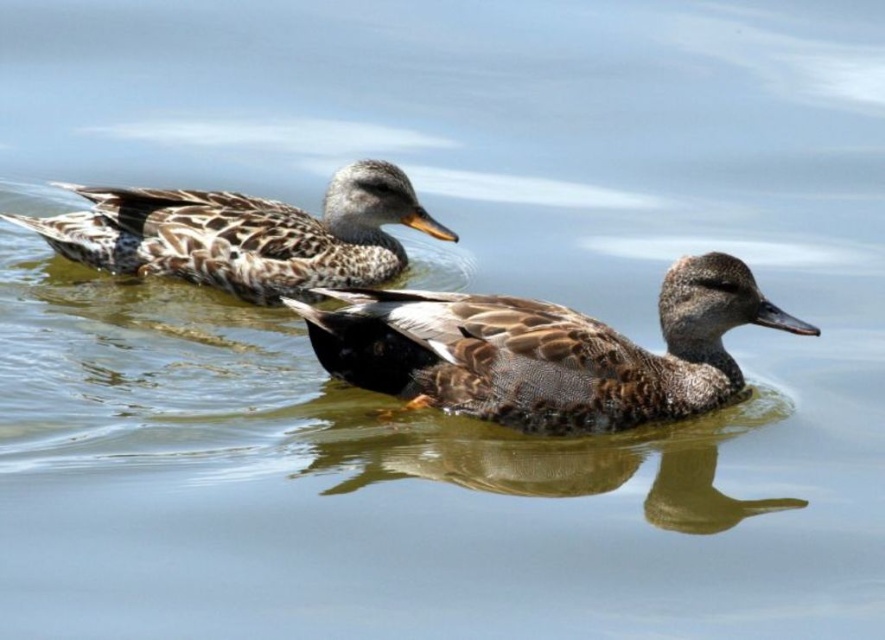
Does brown matte duck at center appear on the right side of speckled feathered duck at upper left?

Yes, brown matte duck at center is to the right of speckled feathered duck at upper left.

Which is more to the left, brown matte duck at center or speckled feathered duck at upper left?

From the viewer's perspective, speckled feathered duck at upper left appears more on the left side.

This screenshot has width=885, height=640. I want to click on brown matte duck at center, so click(545, 349).